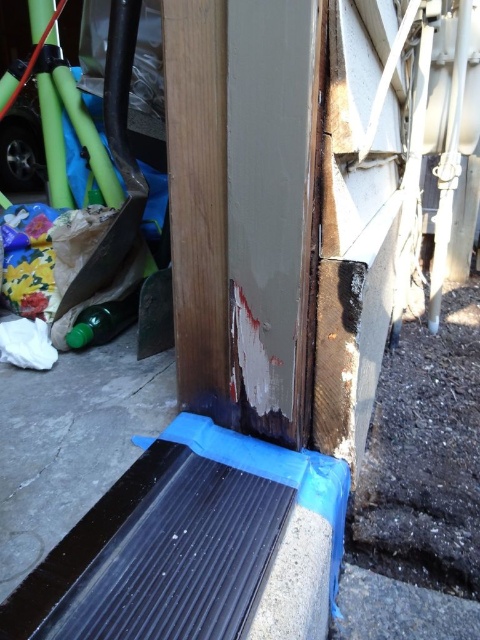
Question: Which object appears closest to the camera in this image?

Choices:
 (A) smooth concrete at lower center
 (B) green translucent bottle at lower left

Answer: (A)

Question: Where is smooth concrete at lower center located in relation to green translucent bottle at lower left in the image?

Choices:
 (A) below
 (B) above

Answer: (A)

Question: Which object is farther from the camera taking this photo?

Choices:
 (A) smooth concrete at lower center
 (B) green translucent bottle at lower left

Answer: (B)

Question: Can you confirm if smooth concrete at lower center is positioned to the right of green translucent bottle at lower left?

Choices:
 (A) yes
 (B) no

Answer: (A)

Question: Can you confirm if smooth concrete at lower center is positioned above green translucent bottle at lower left?

Choices:
 (A) no
 (B) yes

Answer: (A)